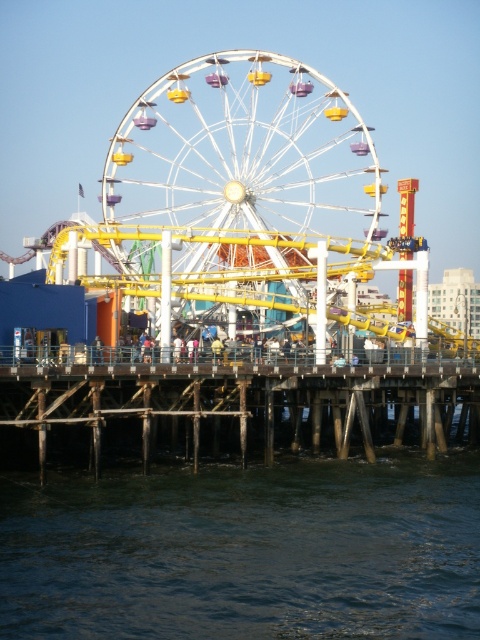
Is dark blue water at lower center further to camera compared to wooden at center?

No, dark blue water at lower center is in front of wooden at center.

Which is more to the left, dark blue water at lower center or wooden at center?

Positioned to the left is dark blue water at lower center.

Who is more distant from viewer, (x=427, y=474) or (x=227, y=419)?

The point (x=227, y=419) is behind.

Where is `dark blue water at lower center`? dark blue water at lower center is located at coordinates (245, 550).

Is the position of white metallic ferris wheel at center less distant than that of wooden at center?

No, white metallic ferris wheel at center is further to the viewer.

Image resolution: width=480 pixels, height=640 pixels. What do you see at coordinates (242, 188) in the screenshot? I see `white metallic ferris wheel at center` at bounding box center [242, 188].

Locate an element on the screen. This screenshot has width=480, height=640. white metallic ferris wheel at center is located at coordinates (242, 188).

What do you see at coordinates (245, 550) in the screenshot? Image resolution: width=480 pixels, height=640 pixels. I see `dark blue water at lower center` at bounding box center [245, 550].

The image size is (480, 640). In order to click on dark blue water at lower center in this screenshot , I will do `click(245, 550)`.